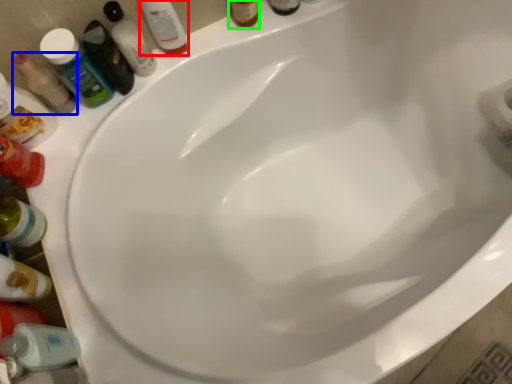
Question: Which is nearer to the mouthwash (highlighted by a red box)? mouthwash (highlighted by a blue box) or toiletry (highlighted by a green box).

Choices:
 (A) mouthwash
 (B) toiletry

Answer: (B)